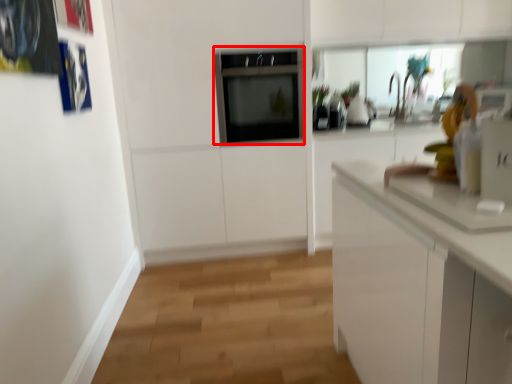
Question: In this image, where is oven (annotated by the red box) located relative to appliance?

Choices:
 (A) right
 (B) left

Answer: (B)